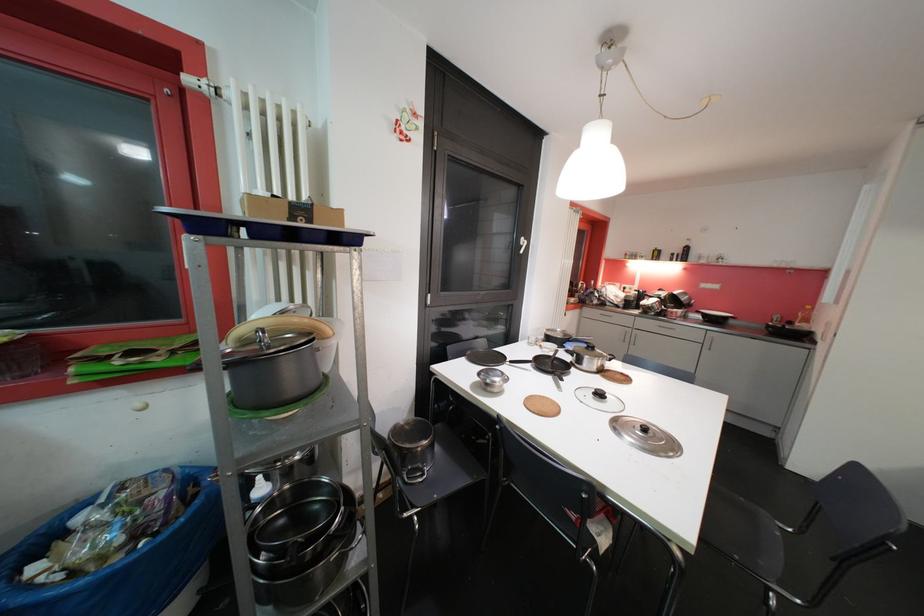
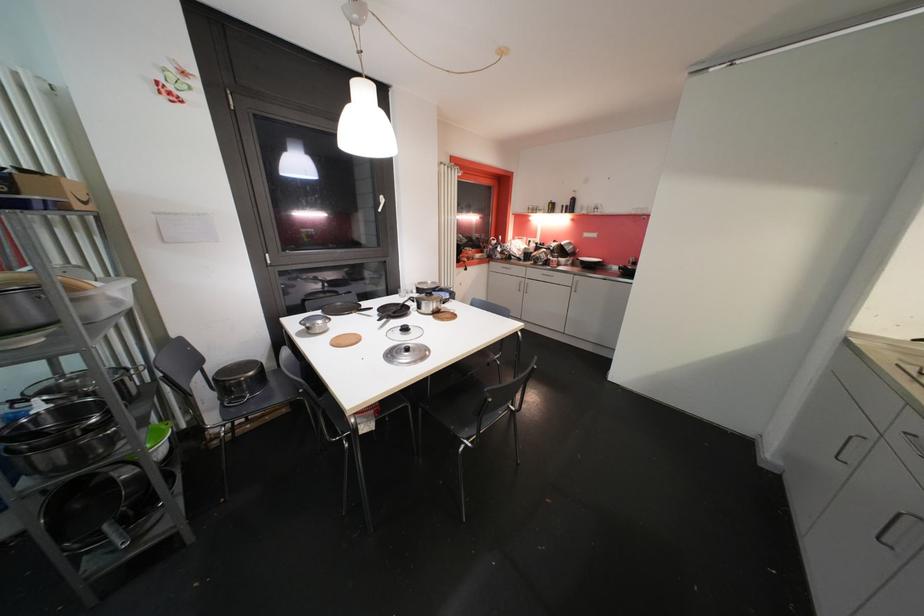
Question: I am providing you with two images of the same scene from different viewpoints. After the viewpoint changes to image2, which objects are now occluded?

Choices:
 (A) white window handle
 (B) book spine
 (C) frying pan handle
 (D) clear plastic container

Answer: (C)